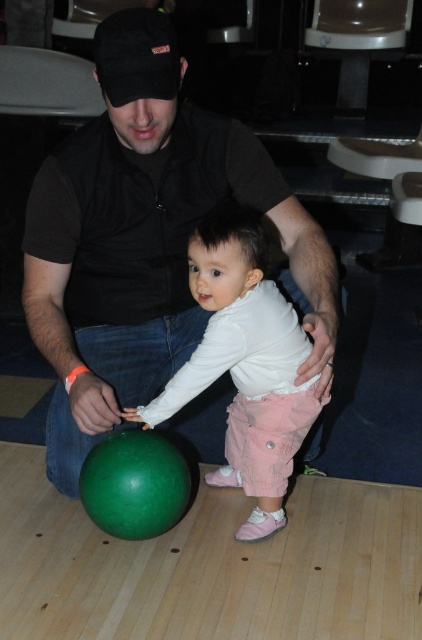
Between black matte shirt at center and matte white shirt at center, which one is positioned higher?

black matte shirt at center is higher up.

Is black matte shirt at center to the left of matte white shirt at center from the viewer's perspective?

Indeed, black matte shirt at center is positioned on the left side of matte white shirt at center.

The width and height of the screenshot is (422, 640). What do you see at coordinates (146, 240) in the screenshot?
I see `black matte shirt at center` at bounding box center [146, 240].

Identify the location of black matte shirt at center. This screenshot has height=640, width=422. (146, 240).